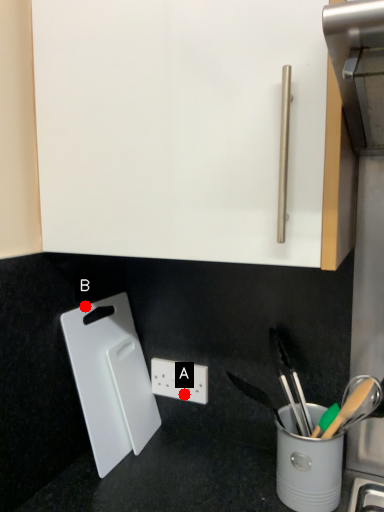
Question: Two points are circled on the image, labeled by A and B beside each circle. Which point is closer to the camera taking this photo?

Choices:
 (A) A is closer
 (B) B is closer

Answer: (B)